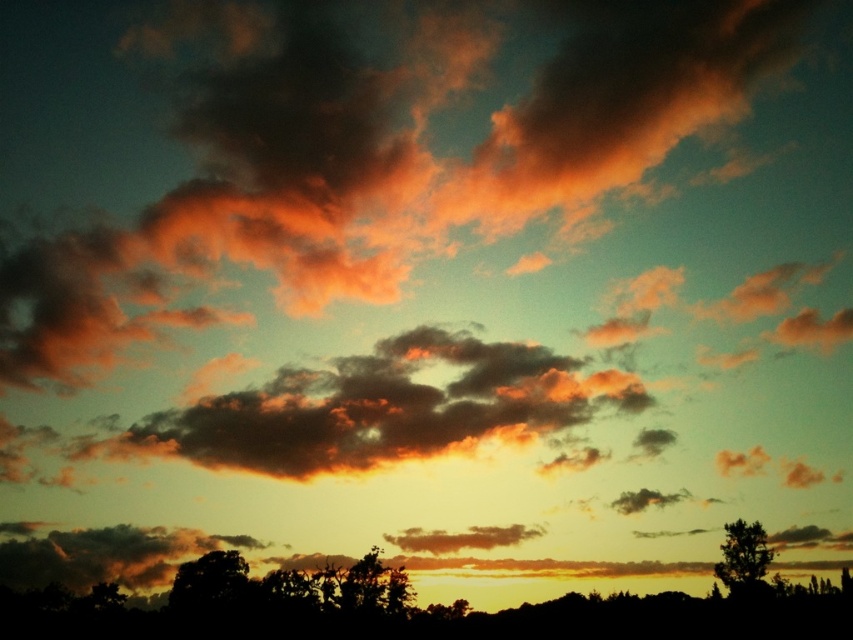
Which is below, silhouette tree at lower right or matte orange cloud at center?

matte orange cloud at center is below.

Which is in front, point (728, 557) or point (495, 545)?

Point (728, 557) is more forward.

Describe the element at coordinates (743, 557) in the screenshot. The image size is (853, 640). I see `silhouette tree at lower right` at that location.

Find the location of `silhouette tree at lower right`. silhouette tree at lower right is located at coordinates (743, 557).